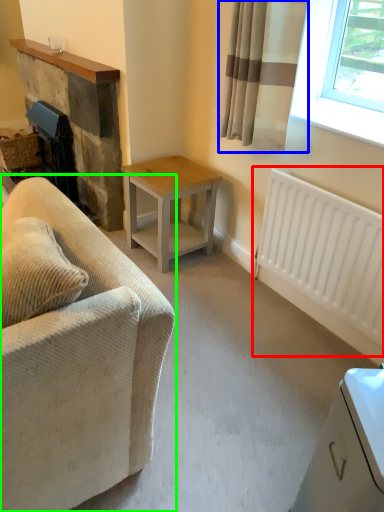
Question: Considering the real-world distances, which object is closest to radiator (highlighted by a red box)? curtain (highlighted by a blue box) or studio couch (highlighted by a green box).

Choices:
 (A) curtain
 (B) studio couch

Answer: (A)